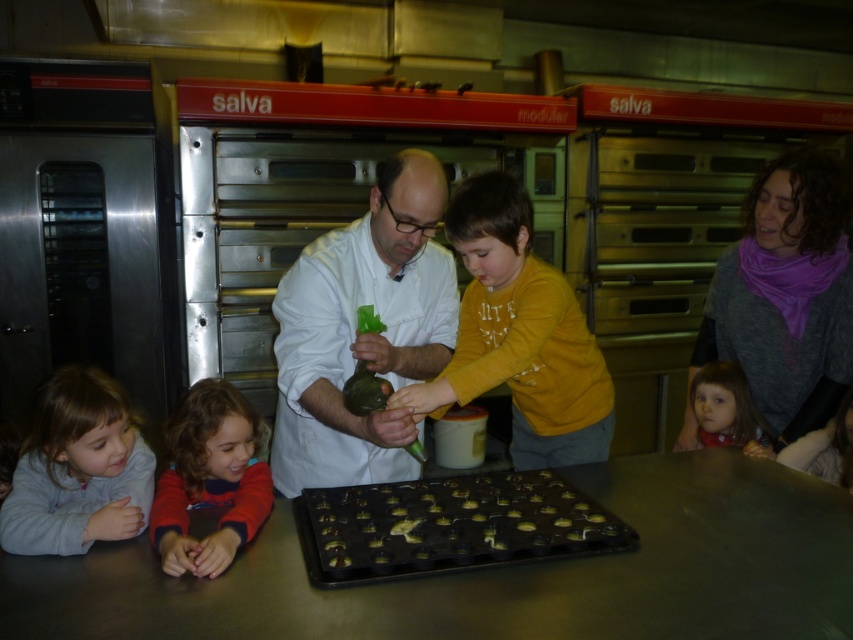
You are a customer observing the scene from the entrance. You notice the white matte chef coat at center and the purple scarf at upper right. Which of these two items is closer to your line of sight?

The white matte chef coat at center is closer to your line of sight because it is shorter than the purple scarf at upper right, meaning it occupies a lower vertical position in the image.

Based on the photo, you are a delivery person who needs to place a new baking tray in the exact center of the existing golden chocolate tray at center. What coordinates should you aim for?

The golden chocolate tray at center is already positioned at coordinates point (x=453, y=524), so you should place the new baking tray at the same coordinates to ensure it is centered.